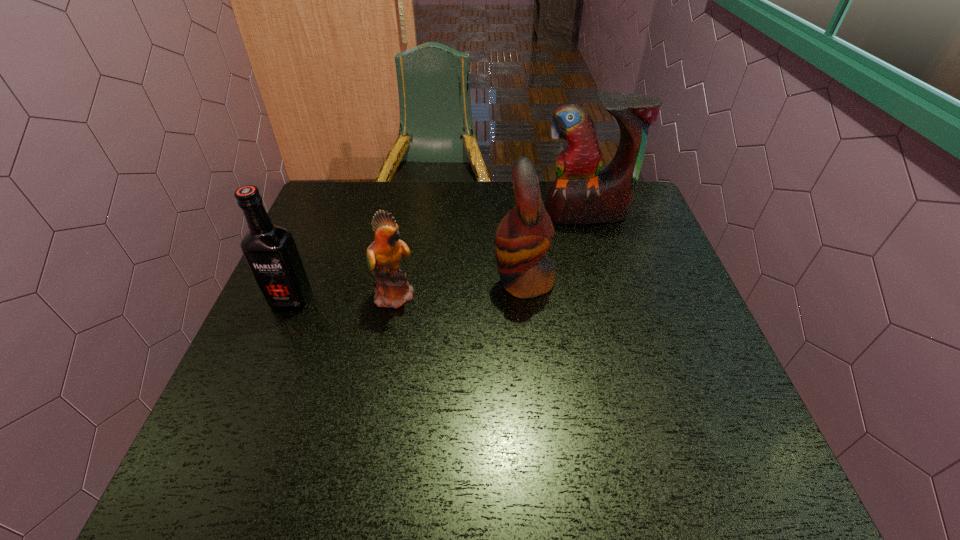
Locate an element on the screen. This screenshot has height=540, width=960. the farthest parrot is located at coordinates (581, 194).

Find the location of a particular element. The image size is (960, 540). the leftmost object is located at coordinates (270, 251).

Find the location of a particular element. This screenshot has height=540, width=960. the second object from left to right is located at coordinates (384, 255).

Identify the location of the leftmost parrot. (384, 255).

Where is `vacant region located at the face of the farthest object`? vacant region located at the face of the farthest object is located at coordinates (620, 333).

You are a GUI agent. You are given a task and a screenshot of the screen. Output one action in this format:
    pyautogui.click(x=<x>, y=<y>)
    Task: Click on the blank space located on the front-facing side of the leftmost object
    This screenshot has width=960, height=540.
    Given the screenshot: What is the action you would take?
    pyautogui.click(x=222, y=467)

This screenshot has width=960, height=540. Identify the location of vacant region located 0.360m on the front-facing side of the shortest parrot. (562, 294).

Locate an element on the screen. object present at the far edge is located at coordinates (581, 194).

Locate an element on the screen. This screenshot has height=540, width=960. object located in the left edge section of the desktop is located at coordinates (270, 251).

The width and height of the screenshot is (960, 540). I want to click on object positioned at the right edge, so click(x=581, y=194).